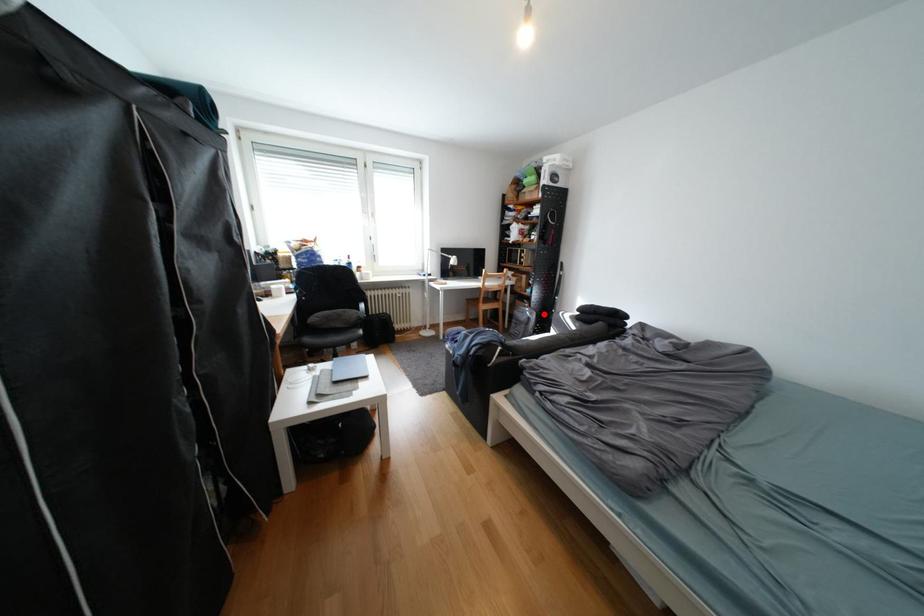
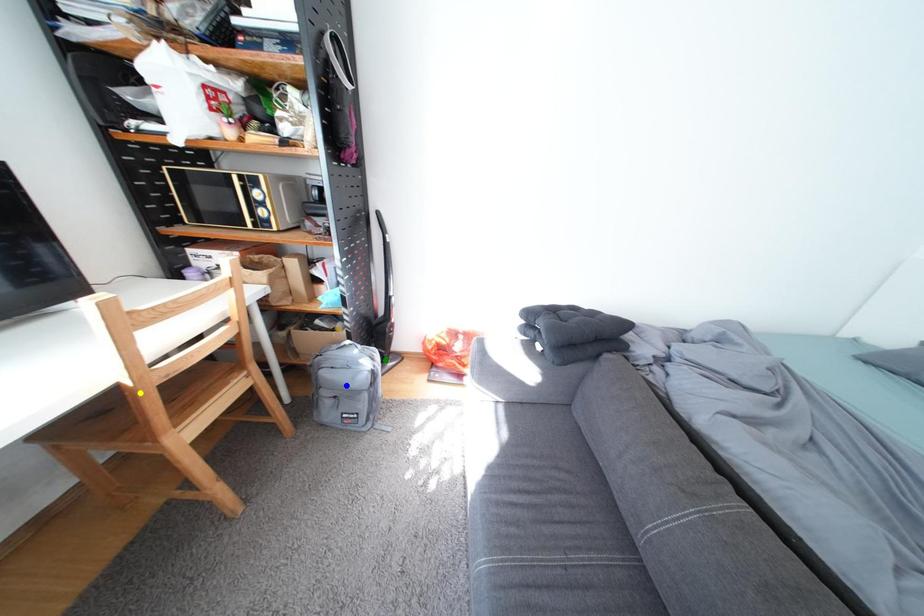
Question: I am providing you with two images of the same scene from different viewpoints. A red point is marked on the first image. You are given multiple points on the second image. Which spot in image 2 lines up with the point in image 1?

Choices:
 (A) yellow point
 (B) blue point
 (C) green point

Answer: (C)